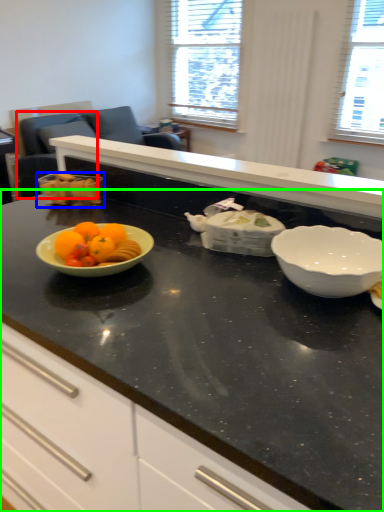
Question: Estimate the real-world distances between objects in this image. Which object is farther from armchair (highlighted by a red box), tableware (highlighted by a blue box) or countertop (highlighted by a green box)?

Choices:
 (A) tableware
 (B) countertop

Answer: (B)